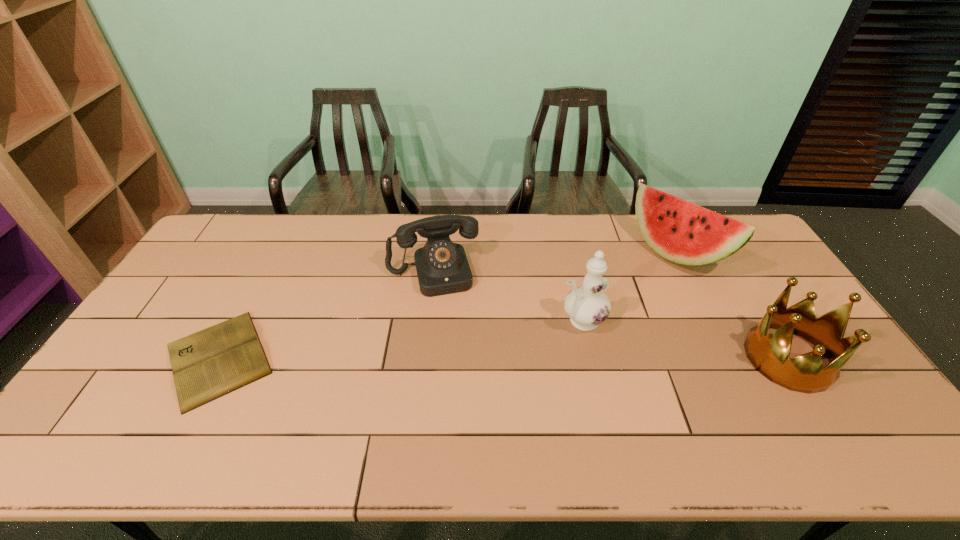
This screenshot has width=960, height=540. What are the coordinates of `book` in the screenshot? It's located at (206, 365).

Identify the location of the leftmost object. (206, 365).

You are a GUI agent. You are given a task and a screenshot of the screen. Output one action in this format:
    pyautogui.click(x=<x>, y=<y>)
    Task: Click on the crown
    
    Given the screenshot: What is the action you would take?
    pyautogui.click(x=769, y=354)

You are a GUI agent. You are given a task and a screenshot of the screen. Output one action in this format:
    pyautogui.click(x=<x>, y=<y>)
    Task: Click on the fourth tallest object
    This screenshot has width=960, height=540.
    Given the screenshot: What is the action you would take?
    click(442, 267)

You are a GUI agent. You are given a task and a screenshot of the screen. Output one action in this format:
    pyautogui.click(x=<x>, y=<y>)
    Task: Click on the telephone
    This screenshot has height=540, width=960.
    Given the screenshot: What is the action you would take?
    pyautogui.click(x=442, y=267)

At what (x,y) coordinates should I click in order to perform the action: click on the tallest object. Please return your answer as a coordinate pair (x, y). Image resolution: width=960 pixels, height=540 pixels. Looking at the image, I should click on (588, 305).

At what (x,y) coordinates should I click in order to perform the action: click on the third object from left to right. Please return your answer as a coordinate pair (x, y). The width and height of the screenshot is (960, 540). Looking at the image, I should click on (588, 305).

Where is `watermelon`? This screenshot has width=960, height=540. watermelon is located at coordinates (682, 232).

Find the location of a particular element. The image size is (960, 540). vacant point located 0.090m on the back of the leftmost object is located at coordinates (254, 291).

Identify the location of vacant space located on the back of the crown. (720, 248).